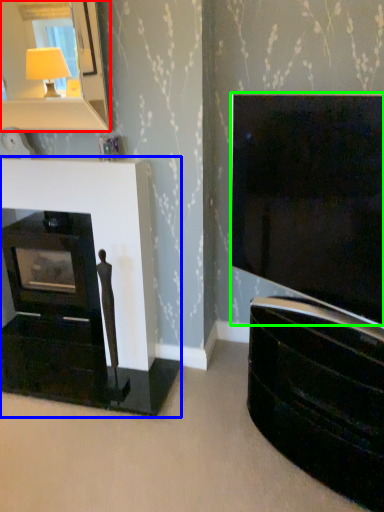
Question: Considering the real-world distances, which object is farthest from mirror (highlighted by a red box)? fireplace (highlighted by a blue box) or television (highlighted by a green box)?

Choices:
 (A) fireplace
 (B) television

Answer: (B)